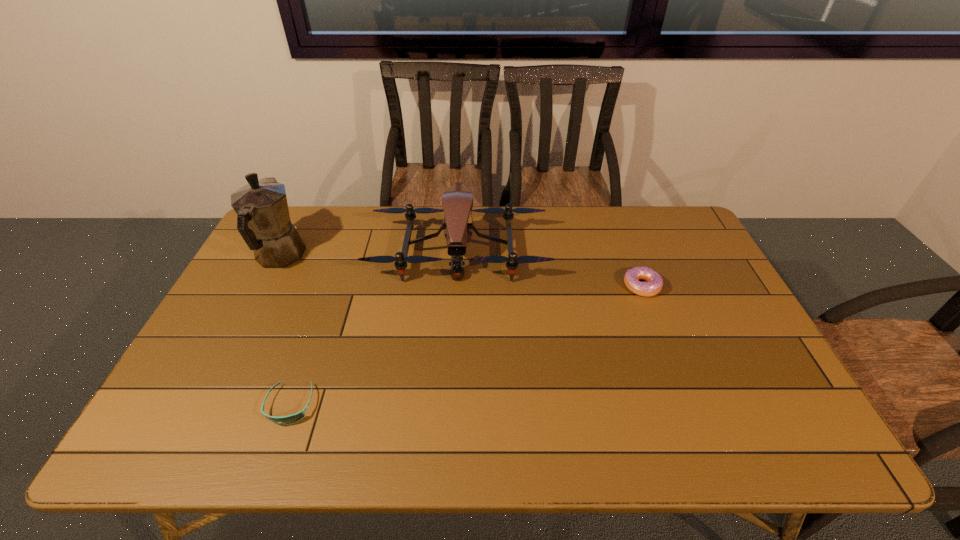
The image size is (960, 540). I want to click on the tallest object, so click(263, 220).

Find the location of a particular element. This screenshot has height=540, width=960. coffeepot is located at coordinates (263, 220).

You are a GUI agent. You are given a task and a screenshot of the screen. Output one action in this format:
    pyautogui.click(x=<x>, y=<y>)
    Task: Click on the second tallest object
    The image size is (960, 540).
    Given the screenshot: What is the action you would take?
    pyautogui.click(x=457, y=201)

At what (x,y) coordinates should I click in order to perform the action: click on drone. Please return your answer as a coordinate pair (x, y). This screenshot has height=540, width=960. Looking at the image, I should click on (457, 201).

Where is `the third tallest object`? The image size is (960, 540). the third tallest object is located at coordinates (654, 285).

You are a GUI agent. You are given a task and a screenshot of the screen. Output one action in this format:
    pyautogui.click(x=<x>, y=<y>)
    Task: Click on the doughnut
    The height and width of the screenshot is (540, 960).
    Given the screenshot: What is the action you would take?
    pyautogui.click(x=654, y=285)

At what (x,y) coordinates should I click in order to perform the action: click on the second object from left to right. Please return your answer as a coordinate pair (x, y). This screenshot has width=960, height=540. Looking at the image, I should click on (293, 418).

The height and width of the screenshot is (540, 960). I want to click on the nearest object, so click(x=293, y=418).

The height and width of the screenshot is (540, 960). I want to click on vacant point located 0.140m on the pouring side of the tallest object, so click(303, 210).

The height and width of the screenshot is (540, 960). I want to click on vacant region located 0.090m on the front-facing side of the third object from left to right, so click(456, 307).